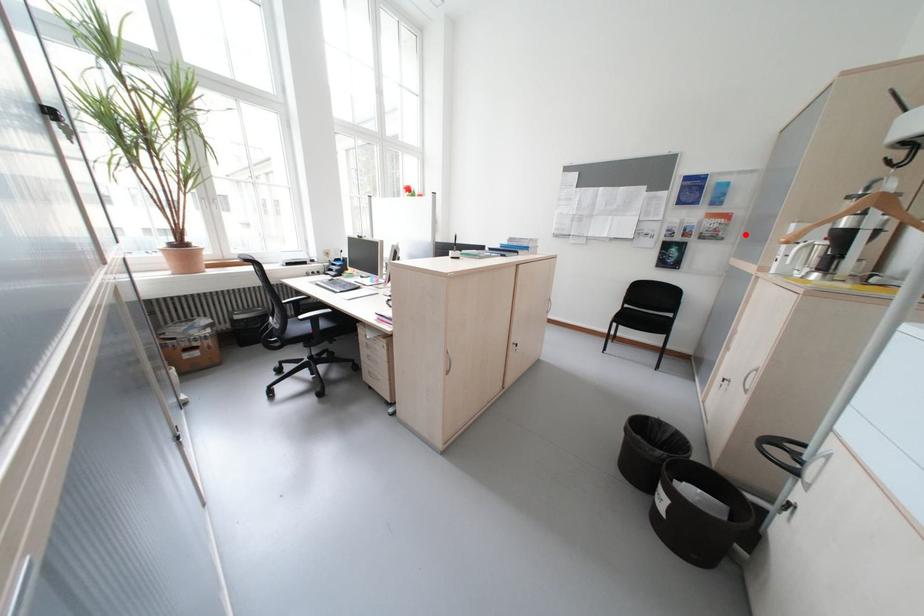
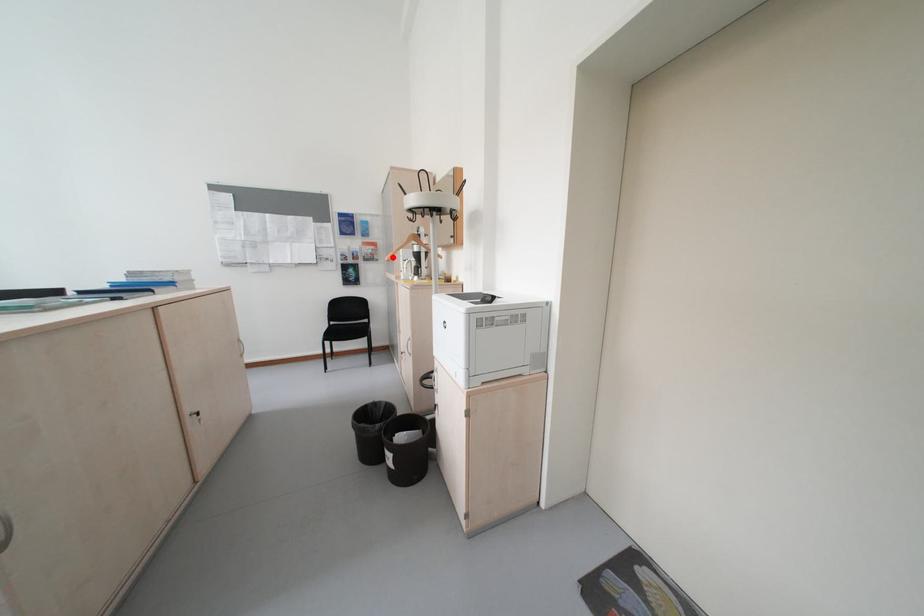
I am providing you with two images of the same scene from different viewpoints. A red point is marked on the first image and another point is marked on the second image. Is the red point in image1 aligned with the point shown in image2?

Yes